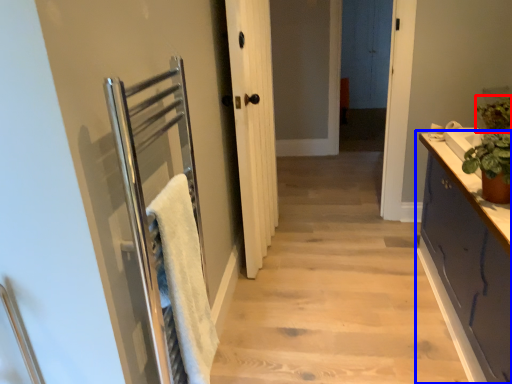
Question: Which object is further to the camera taking this photo, plant (highlighted by a red box) or cabinetry (highlighted by a blue box)?

Choices:
 (A) plant
 (B) cabinetry

Answer: (A)